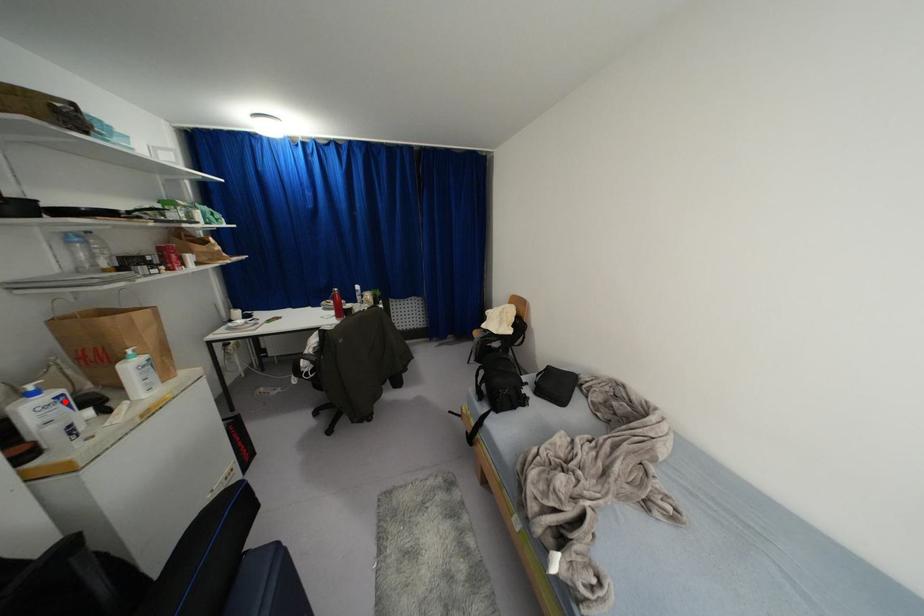
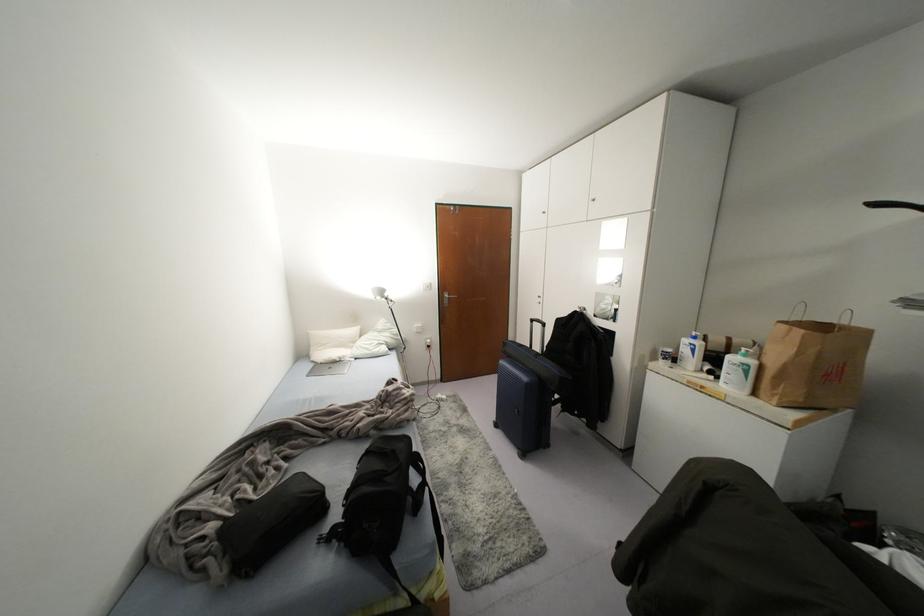
Where in the second image is the point corresponding to the highlighted location from the first image?

(691, 350)